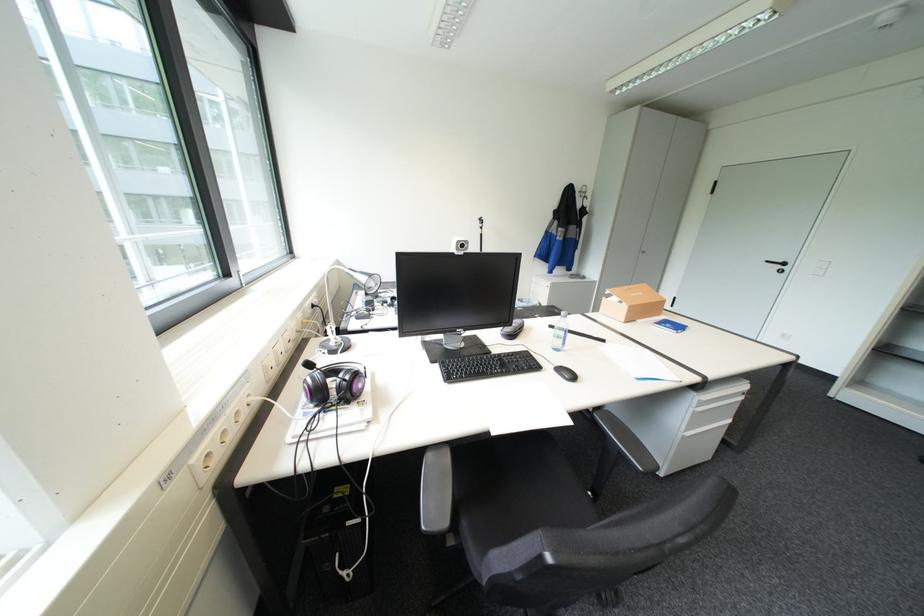
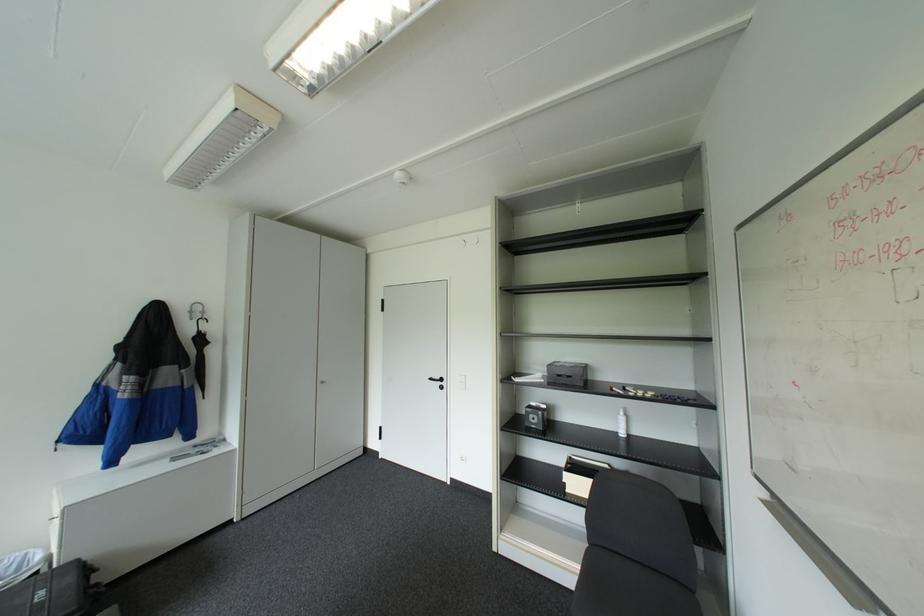
The point at (590, 196) is marked in the first image. Where is the corresponding point in the second image?

(200, 318)